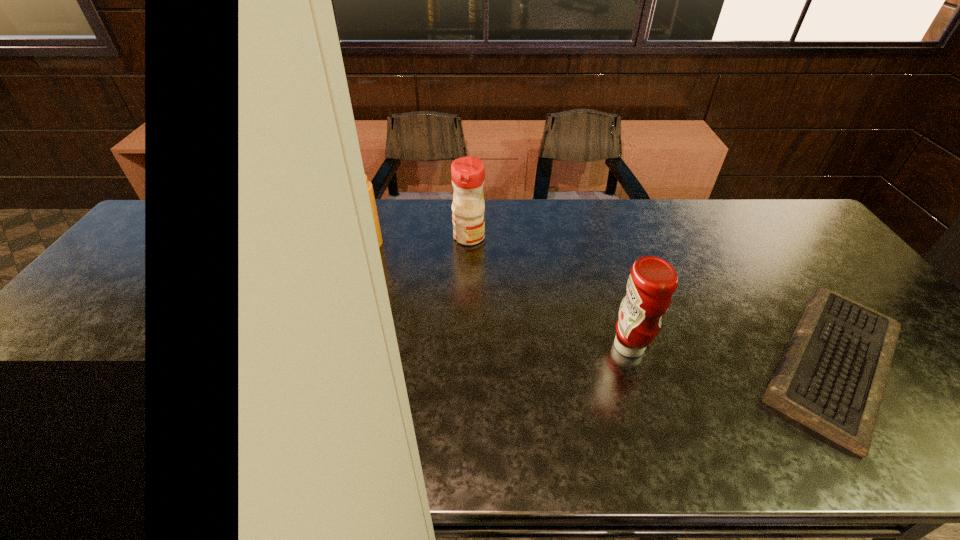
Identify the location of the leftmost condiment. This screenshot has height=540, width=960. (369, 185).

Where is `the second condiment from left to right`? The width and height of the screenshot is (960, 540). the second condiment from left to right is located at coordinates (468, 173).

Where is `the nearest condiment`? Image resolution: width=960 pixels, height=540 pixels. the nearest condiment is located at coordinates (652, 281).

Find the location of a particular element. The image size is (960, 540). the second object from right to left is located at coordinates (652, 281).

Where is `vacant position located on the left of the leftmost object`? vacant position located on the left of the leftmost object is located at coordinates (319, 243).

Identify the location of vacant region located 0.300m on the left of the second condiment from right to left. (361, 237).

This screenshot has width=960, height=540. I want to click on free space located on the right of the rightmost condiment, so click(x=681, y=347).

What are the coordinates of `free space at the far edge` in the screenshot? It's located at (649, 201).

Identify the location of vacant area at the near edge of the desktop. (326, 428).

Where is `blank space at the left edge of the desktop`? blank space at the left edge of the desktop is located at coordinates (115, 319).